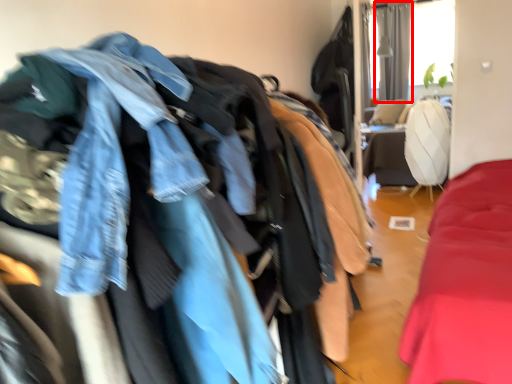
Question: From the image, what is the correct spatial relationship of curtain (annotated by the red box) in relation to jacket?

Choices:
 (A) right
 (B) left

Answer: (A)